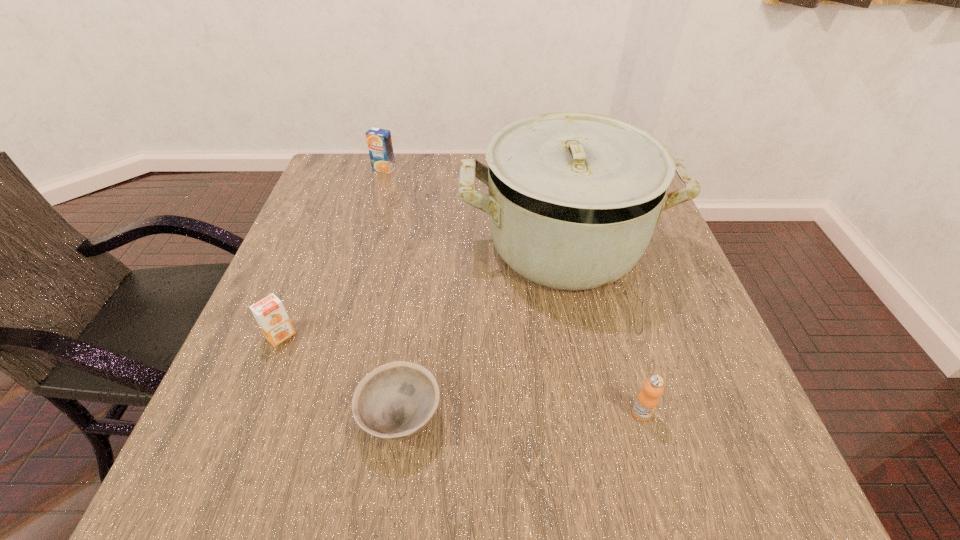
At what (x,y) coordinates should I click in order to perform the action: click on object at the far right corner. Please return your answer as a coordinate pair (x, y). Looking at the image, I should click on (573, 198).

At what (x,y) coordinates should I click in order to perform the action: click on vacant region at the far edge of the desktop. Please return your answer as a coordinate pair (x, y). The image size is (960, 540). Looking at the image, I should click on (457, 179).

Where is `vacant region at the near edge of the desktop`? vacant region at the near edge of the desktop is located at coordinates (652, 469).

Where is `free space at the left edge of the desktop`? This screenshot has height=540, width=960. free space at the left edge of the desktop is located at coordinates (310, 323).

Identify the location of vacant space at the right edge. The height and width of the screenshot is (540, 960). (661, 315).

The height and width of the screenshot is (540, 960). Identify the location of free space at the far left corner of the desktop. (342, 160).

The image size is (960, 540). I want to click on blank region between the rightmost orange juice and the saucepan, so click(x=603, y=329).

Where is `blank region between the rightmost orange juice and the fourth nearest object`? blank region between the rightmost orange juice and the fourth nearest object is located at coordinates (603, 329).

Where is `vacant area between the third farthest object and the bowl`? vacant area between the third farthest object and the bowl is located at coordinates (341, 377).

Find the location of `free spot between the third object from right to left and the saucepan`. free spot between the third object from right to left and the saucepan is located at coordinates (482, 331).